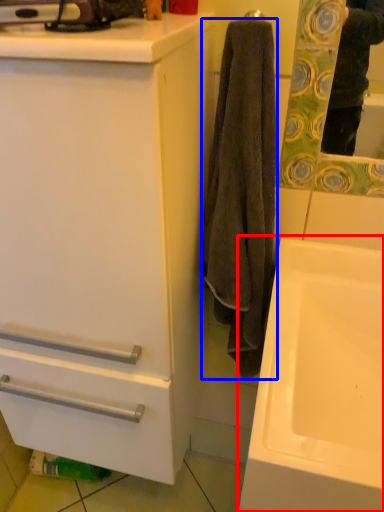
Question: Among these objects, which one is farthest to the camera, sink (highlighted by a red box) or towel/napkin (highlighted by a blue box)?

Choices:
 (A) sink
 (B) towel/napkin

Answer: (B)